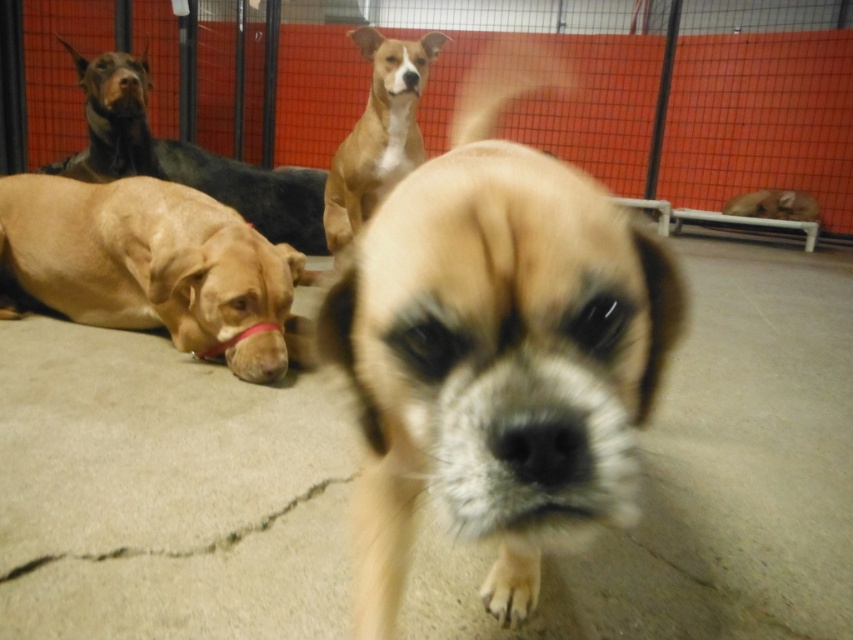
Which of these two, brown smooth coat at left or black smooth nose at upper left, stands shorter?

black smooth nose at upper left

Can you confirm if brown smooth coat at left is bigger than black smooth nose at upper left?

Indeed, brown smooth coat at left has a larger size compared to black smooth nose at upper left.

The image size is (853, 640). What do you see at coordinates (186, 157) in the screenshot?
I see `brown smooth coat at left` at bounding box center [186, 157].

Find the location of a particular element. The height and width of the screenshot is (640, 853). brown smooth coat at left is located at coordinates (186, 157).

Can you confirm if brown smooth coat at left is taller than brown smooth dog at upper center?

Indeed, brown smooth coat at left has a greater height compared to brown smooth dog at upper center.

Is brown smooth coat at left wider than brown smooth dog at upper center?

Yes, brown smooth coat at left is wider than brown smooth dog at upper center.

Which is behind, point (241, 195) or point (376, 198)?

Positioned behind is point (241, 195).

In order to click on brown smooth coat at left in this screenshot , I will do `click(186, 157)`.

Describe the element at coordinates (494, 344) in the screenshot. I see `light brown fur at center` at that location.

Can you confirm if light brown fur at center is positioned below black smooth nose at upper left?

Yes.

Between point (619, 428) and point (111, 80), which one is positioned behind?

The point (111, 80) is behind.

Locate an element on the screen. This screenshot has width=853, height=640. light brown fur at center is located at coordinates (494, 344).